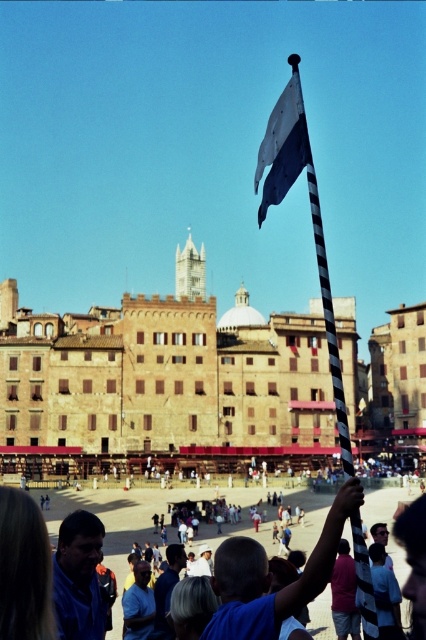
Question: Which of the following is the farthest from the observer?

Choices:
 (A) (173, 384)
 (B) (279, 96)

Answer: (B)

Question: Which point is farther from the camera taking this photo?

Choices:
 (A) (259, 221)
 (B) (98, 456)

Answer: (A)

Question: Can you confirm if brown stone building at center is positioned to the right of white fabric flag at upper center?

Choices:
 (A) no
 (B) yes

Answer: (A)

Question: Can you confirm if brown stone building at center is smaller than white fabric flag at upper center?

Choices:
 (A) no
 (B) yes

Answer: (A)

Question: Can you confirm if brown stone building at center is bigger than white fabric flag at upper center?

Choices:
 (A) no
 (B) yes

Answer: (B)